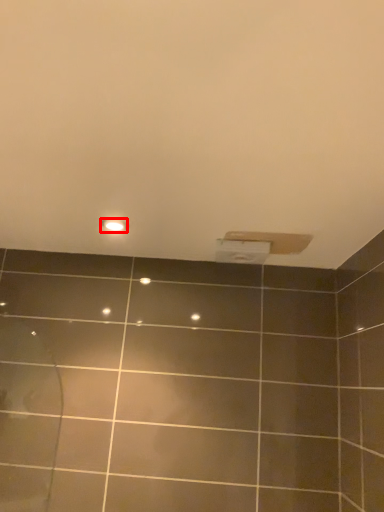
Question: From the image's perspective, what is the correct spatial positioning of light fixture (annotated by the red box) in reference to toilet paper?

Choices:
 (A) above
 (B) below

Answer: (A)